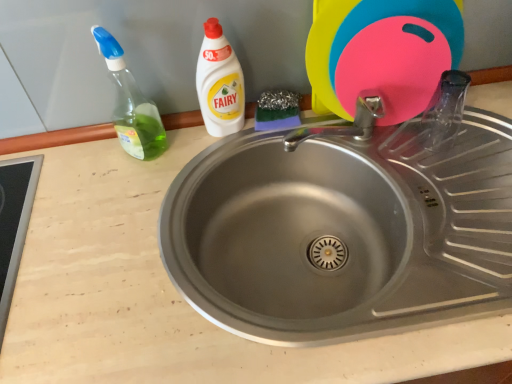
Locate an element on the screen. This screenshot has height=384, width=512. free space in front of white plastic bottle at upper center is located at coordinates (189, 183).